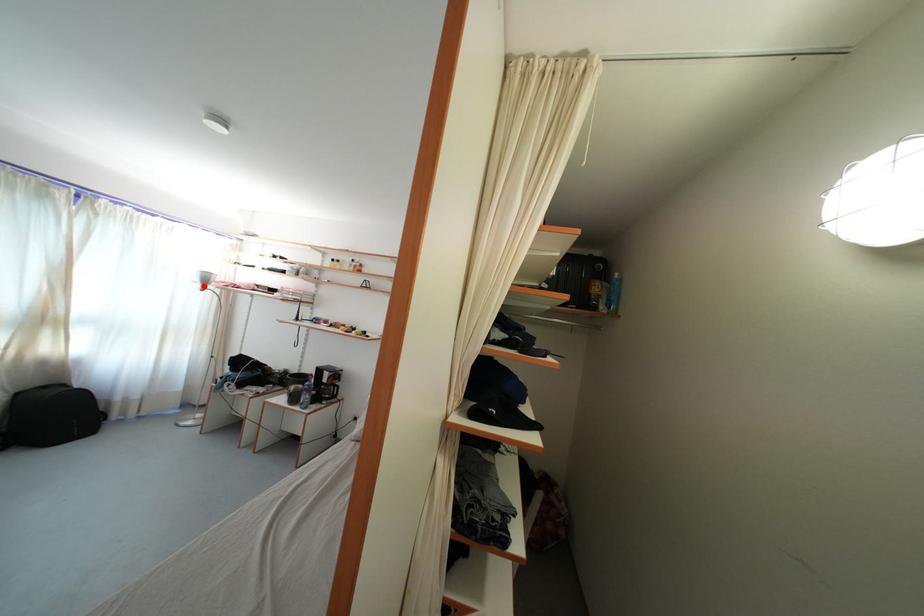
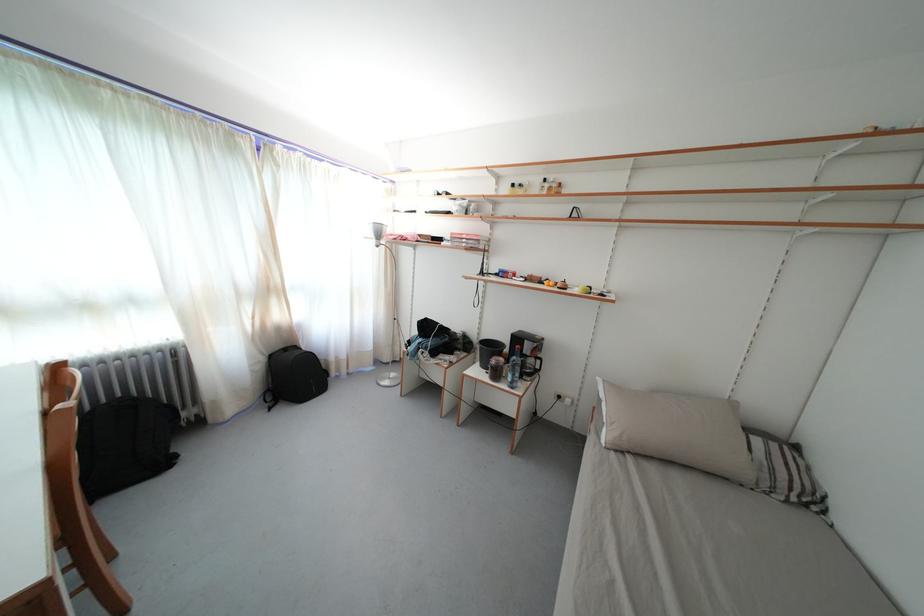
In the second image, find the point that corresponds to the highlighted location in the first image.

(378, 241)